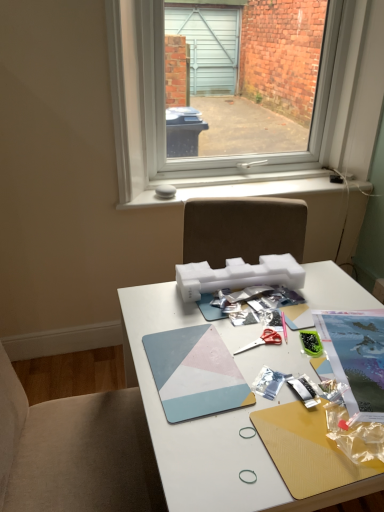
This screenshot has width=384, height=512. What are the coordinates of `free location to the right of red plastic scissors at center` in the screenshot? It's located at (324, 348).